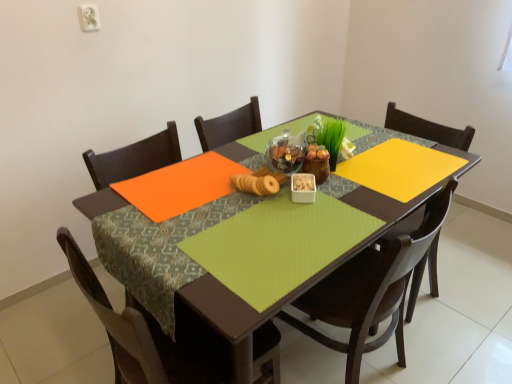
Question: Is white plastic container at center surrounding green fabric table at center?

Choices:
 (A) no
 (B) yes

Answer: (A)

Question: From the image's perspective, is white plastic container at center above green fabric table at center?

Choices:
 (A) no
 (B) yes

Answer: (B)

Question: Would you consider white plastic container at center to be distant from green fabric table at center?

Choices:
 (A) yes
 (B) no

Answer: (B)

Question: Is white plastic container at center located outside green fabric table at center?

Choices:
 (A) no
 (B) yes

Answer: (B)

Question: From a real-world perspective, is white plastic container at center on top of green fabric table at center?

Choices:
 (A) yes
 (B) no

Answer: (A)

Question: Is white plastic container at center facing towards green fabric table at center?

Choices:
 (A) yes
 (B) no

Answer: (B)

Question: Would you say brown wood chair at lower left, the second chair in the right-to-left sequence, contains matte brown cookies at center?

Choices:
 (A) yes
 (B) no

Answer: (B)

Question: Considering the relative sizes of brown wood chair at lower left, which ranks as the 1th chair in left-to-right order, and matte brown cookies at center in the image provided, is brown wood chair at lower left, which ranks as the 1th chair in left-to-right order, shorter than matte brown cookies at center?

Choices:
 (A) no
 (B) yes

Answer: (A)

Question: Is brown wood chair at lower left, the second chair in the right-to-left sequence, bigger than matte brown cookies at center?

Choices:
 (A) no
 (B) yes

Answer: (B)

Question: Is brown wood chair at lower left, which ranks as the 1th chair in left-to-right order, not within matte brown cookies at center?

Choices:
 (A) yes
 (B) no

Answer: (A)

Question: From the image's perspective, is brown wood chair at lower left, which ranks as the 1th chair in left-to-right order, above matte brown cookies at center?

Choices:
 (A) yes
 (B) no

Answer: (B)

Question: Does brown wood chair at lower left, which ranks as the 1th chair in left-to-right order, turn towards matte brown cookies at center?

Choices:
 (A) yes
 (B) no

Answer: (A)

Question: Is green fabric table at center looking in the opposite direction of brown wood chair at lower left, the second chair in the right-to-left sequence?

Choices:
 (A) yes
 (B) no

Answer: (B)